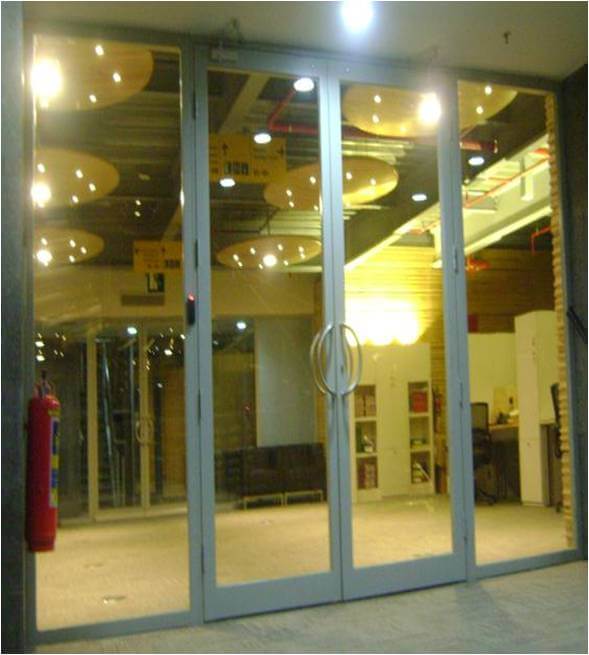
Locate an element on the screen. The image size is (589, 655). shelf is located at coordinates (416, 436), (415, 400), (360, 407), (365, 440), (360, 481), (421, 481).